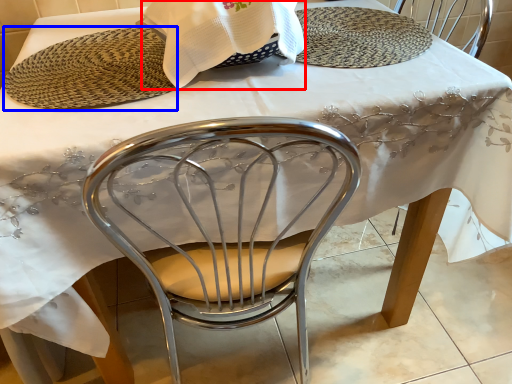
Question: Which of the following is the closest to the observer, blanket (highlighted by a red box) or platter (highlighted by a blue box)?

Choices:
 (A) blanket
 (B) platter

Answer: (A)